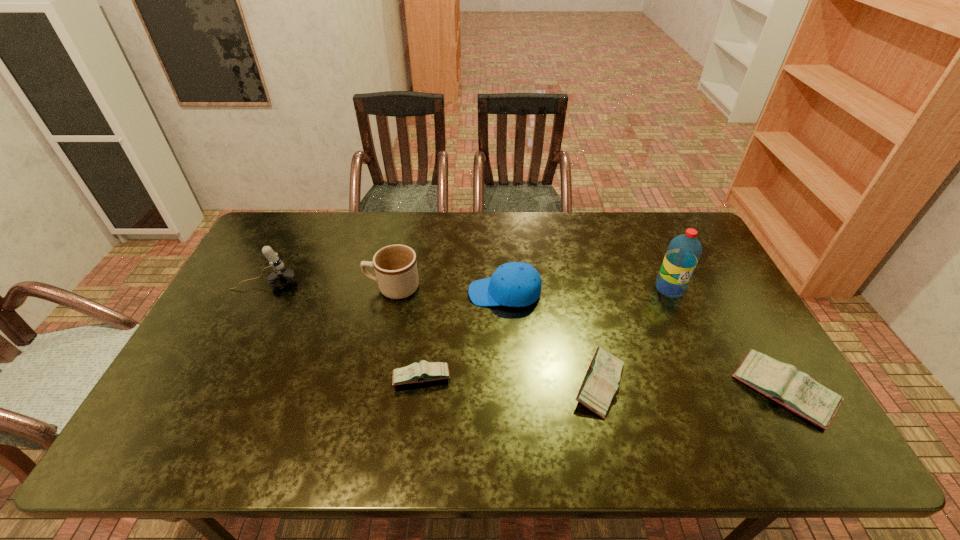
Please point a spot to add another diary on the left. Please provide its 2D coordinates. Your answer should be formatted as a tuple, i.e. [(x, y)], where the tuple contains the x and y coordinates of a point satisfying the conditions above.

[(249, 371)]